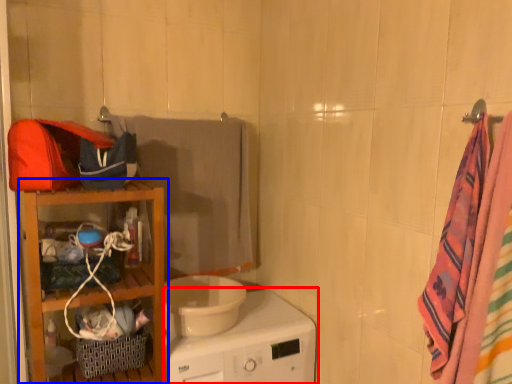
Question: Which object is closer to the camera taking this photo, home appliance (highlighted by a red box) or furniture (highlighted by a blue box)?

Choices:
 (A) home appliance
 (B) furniture

Answer: (A)